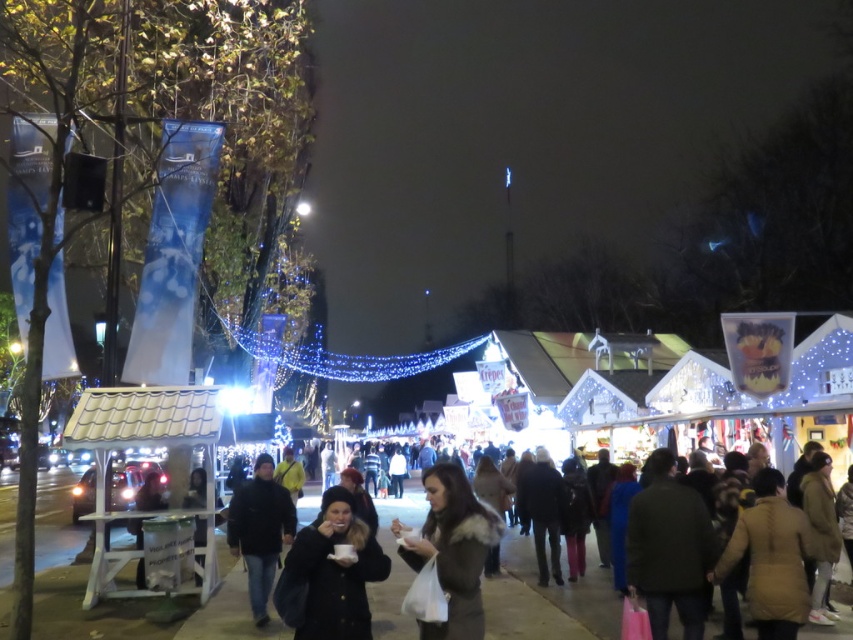
Question: Among these objects, which one is nearest to the camera?

Choices:
 (A) black fuzzy hat at center
 (B) brown fur coat at center

Answer: (B)

Question: Can you confirm if black fuzzy hat at center is positioned to the left of dark blue jacket at center?

Choices:
 (A) yes
 (B) no

Answer: (B)

Question: Which point is farther to the camera?

Choices:
 (A) (236, 506)
 (B) (291, 545)

Answer: (A)

Question: Does black fuzzy hat at center have a larger size compared to dark blue jacket at center?

Choices:
 (A) no
 (B) yes

Answer: (B)

Question: Among these objects, which one is farthest from the camera?

Choices:
 (A) brown fur coat at center
 (B) dark blue jacket at center
 (C) black fuzzy hat at center

Answer: (B)

Question: Is brown fur coat at center wider than dark blue jacket at center?

Choices:
 (A) no
 (B) yes

Answer: (B)